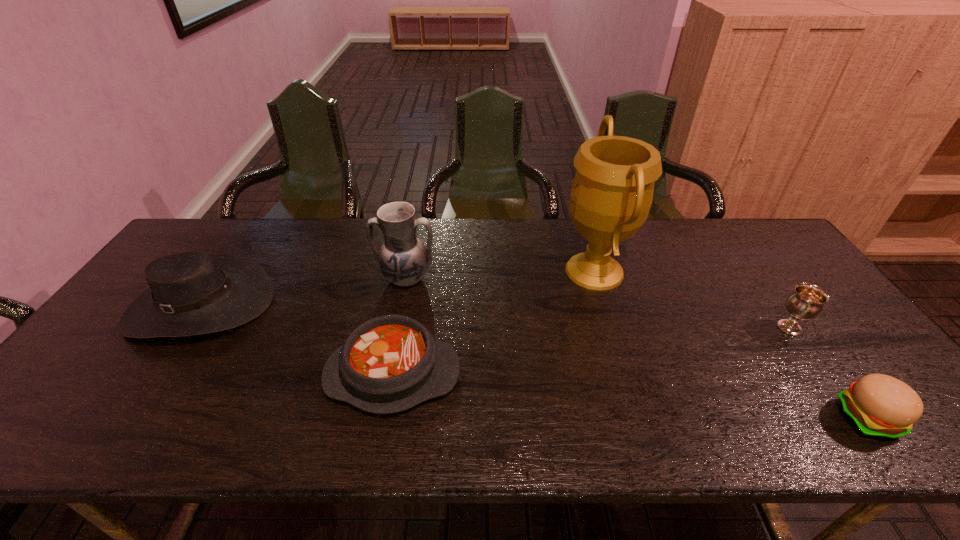
At what (x,y) coordinates should I click in order to perform the action: click on chalice positioned at the right edge. Please return your answer as a coordinate pair (x, y). Looking at the image, I should click on (807, 301).

The image size is (960, 540). What are the coordinates of `hamburger positioned at the right edge` in the screenshot? It's located at (881, 406).

Where is `object that is at the near right corner`? This screenshot has height=540, width=960. object that is at the near right corner is located at coordinates (881, 406).

This screenshot has width=960, height=540. Find the location of `vacant space at the far edge of the desktop`. vacant space at the far edge of the desktop is located at coordinates (503, 232).

You are a GUI agent. You are given a task and a screenshot of the screen. Output one action in this format:
    pyautogui.click(x=<x>, y=<y>)
    Task: Click on the vacant space at the left edge
    The image size is (960, 540).
    Given the screenshot: What is the action you would take?
    pyautogui.click(x=68, y=390)

You are a GUI agent. You are given a task and a screenshot of the screen. Output one action in this format:
    pyautogui.click(x=<x>, y=<y>)
    Task: Click on the vacant region at the far left corner of the desktop
    This screenshot has width=960, height=540.
    Given the screenshot: What is the action you would take?
    pyautogui.click(x=236, y=228)

In order to click on free region at the far right corner of the desktop in this screenshot , I will do `click(766, 245)`.

Where is `empty space that is in between the casserole and the hamburger`? empty space that is in between the casserole and the hamburger is located at coordinates (x=631, y=397).

Where is `free spot between the leftmost object and the chalice`? free spot between the leftmost object and the chalice is located at coordinates (495, 316).

The width and height of the screenshot is (960, 540). In order to click on unoccupied area between the cowboy hat and the hamburger in this screenshot , I will do `click(535, 362)`.